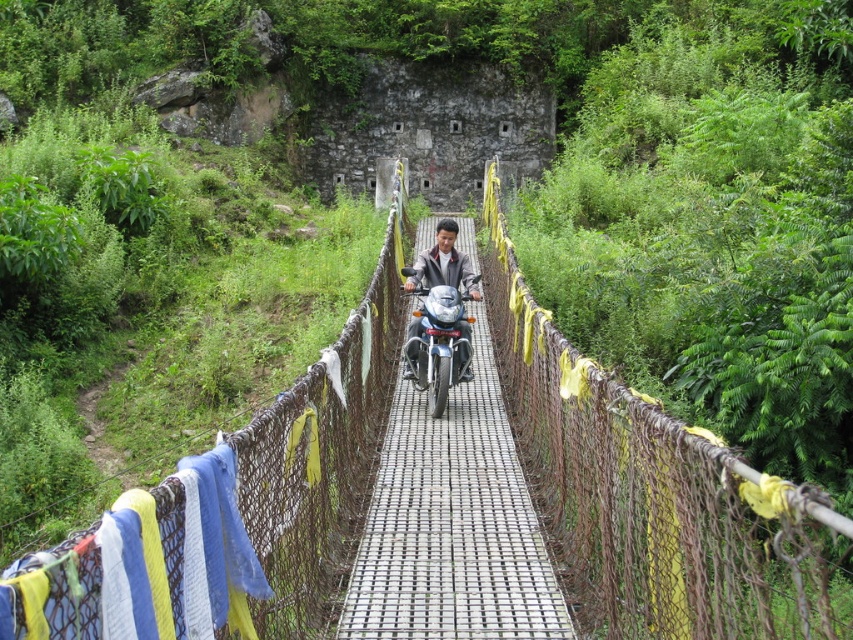
You are a tourist standing on the suspension bridge and see the blue woven cloth at left and the matte black motorcycle at center. Which object is closer to the left edge of the bridge?

The blue woven cloth at left is closer to the left edge of the bridge because it is positioned to the left of the matte black motorcycle at center.

You are a delivery person needing to cross the suspension bridge. Your motorcycle has a length of 2.5 meters. The bridge has a narrow path with a blue woven cloth at left and a matte black motorcycle at center. Can your motorcycle pass between them without touching either?

The distance between the blue woven cloth at left and the matte black motorcycle at center is 10.17 meters. Since the motorcycle is only 2.5 meters long, there is ample space for it to pass between them without touching either object.

In the scene shown: You are a tourist on the suspension bridge and want to take a photo of the blue woven cloth at left and the matte black motorcycle at center. Which object should you point your camera towards first to capture both in the same frame?

The blue woven cloth at left is positioned under the matte black motorcycle at center, so you should point your camera towards the matte black motorcycle at center first to ensure both are visible in the frame.